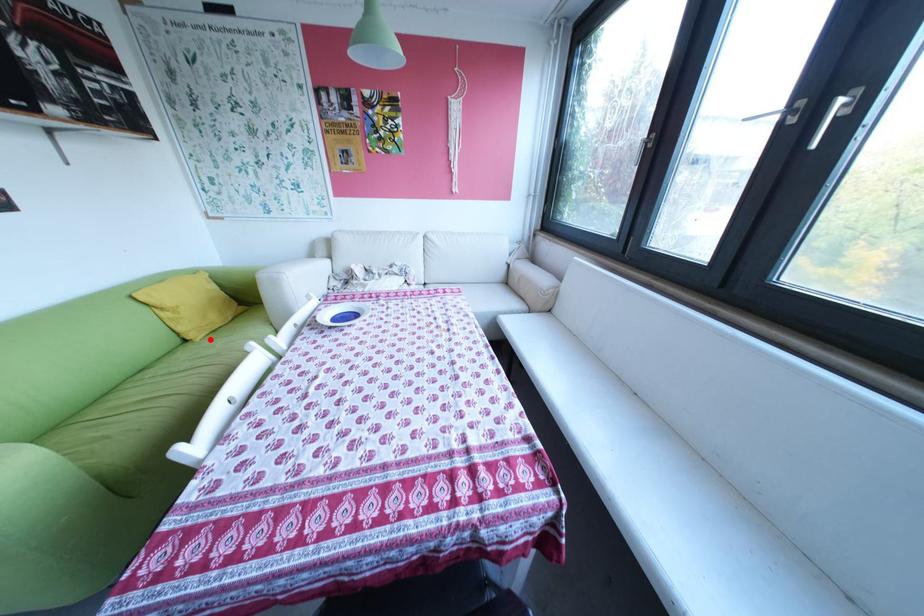
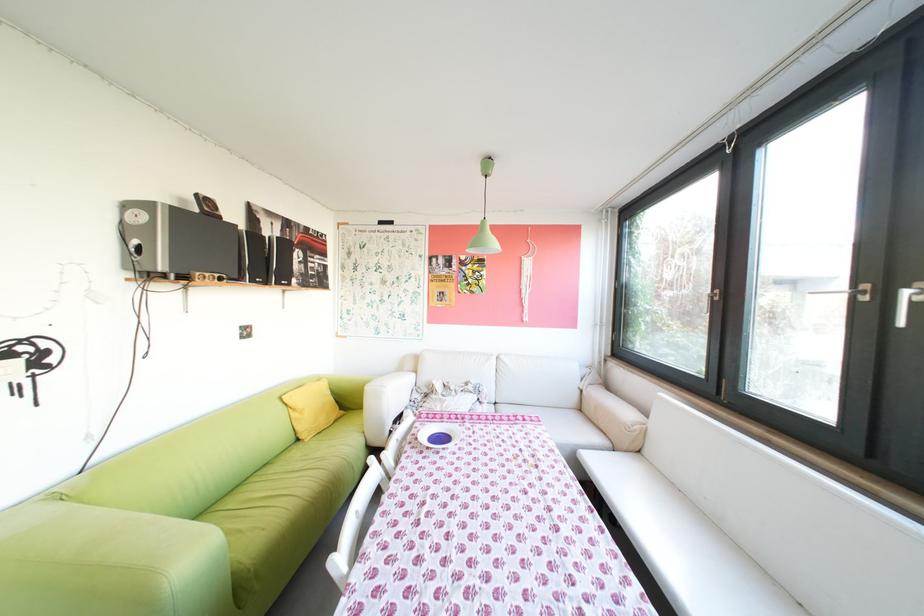
The point at the highlighted location is marked in the first image. Where is the corresponding point in the second image?

(321, 440)